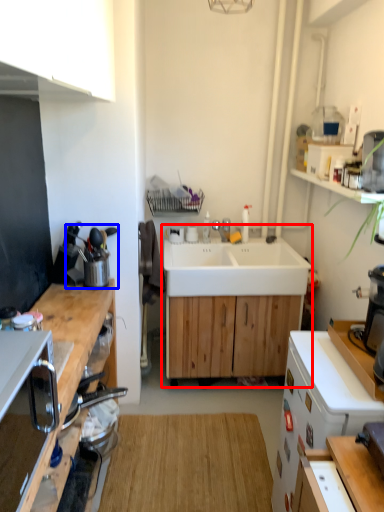
Question: Which of the following is the farthest to the observer, workbench (highlighted by a red box) or appliance (highlighted by a blue box)?

Choices:
 (A) workbench
 (B) appliance

Answer: (A)